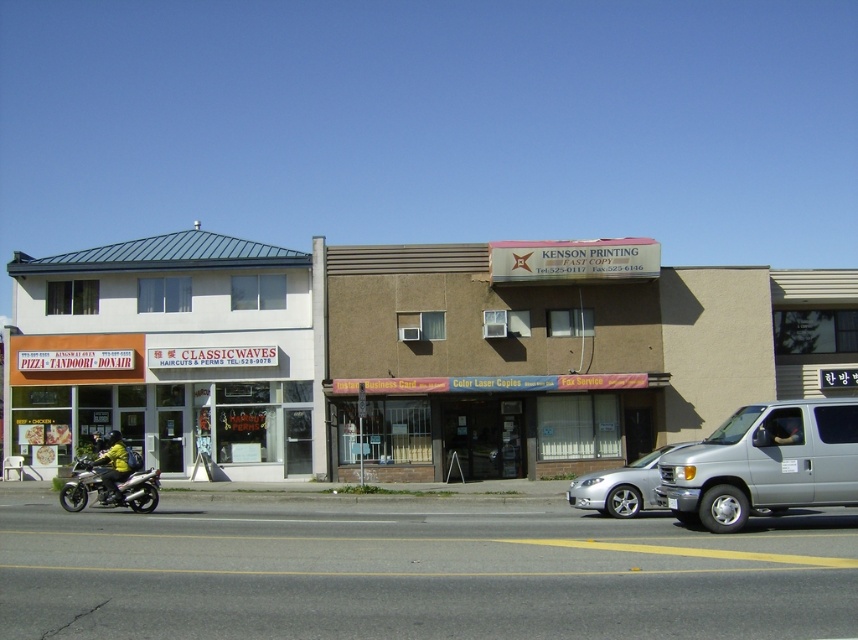
Is point (828, 452) closer to viewer compared to point (153, 500)?

That is True.

Who is taller, silver metallic van at right or metallic silver motorcycle at lower left?

With more height is metallic silver motorcycle at lower left.

Is point (717, 529) farther from camera compared to point (77, 499)?

No.

The height and width of the screenshot is (640, 858). In order to click on silver metallic van at right in this screenshot , I will do `click(764, 464)`.

Who is positioned more to the right, silver metallic sedan at center or metallic silver motorcycle at lower left?

From the viewer's perspective, silver metallic sedan at center appears more on the right side.

Who is more distant from viewer, (656, 472) or (143, 468)?

Positioned behind is point (143, 468).

You are a GUI agent. You are given a task and a screenshot of the screen. Output one action in this format:
    pyautogui.click(x=<x>, y=<y>)
    Task: Click on the silver metallic sedan at center
    This screenshot has height=640, width=858.
    Given the screenshot: What is the action you would take?
    pyautogui.click(x=620, y=486)

The height and width of the screenshot is (640, 858). In order to click on silver metallic sedan at center in this screenshot , I will do `click(620, 486)`.

Who is taller, white matte building at left or silver metallic van at right?

With more height is white matte building at left.

What do you see at coordinates (165, 353) in the screenshot?
I see `white matte building at left` at bounding box center [165, 353].

The height and width of the screenshot is (640, 858). I want to click on white matte building at left, so click(x=165, y=353).